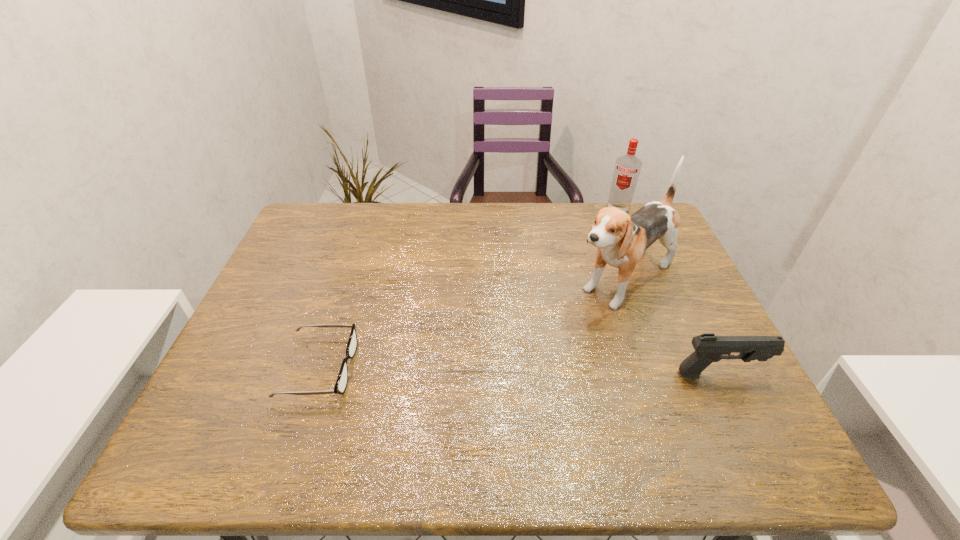
Locate an element on the screen. The image size is (960, 540). free space located on the front label of the second tallest object is located at coordinates (594, 271).

This screenshot has height=540, width=960. In order to click on vacant space located at the face of the puppy in this screenshot , I will do `click(546, 337)`.

Identify the location of free space located at the face of the puppy. point(564,322).

The width and height of the screenshot is (960, 540). In order to click on free space located 0.230m at the face of the puppy in this screenshot , I will do `click(526, 352)`.

This screenshot has width=960, height=540. In order to click on object situated at the far edge in this screenshot , I will do `click(627, 168)`.

I want to click on object located in the near edge section of the desktop, so click(x=342, y=380).

Image resolution: width=960 pixels, height=540 pixels. Find the location of `object at the left edge`. object at the left edge is located at coordinates (342, 380).

Identify the location of pistol located in the right edge section of the desktop. (709, 348).

Where is `vodka that is at the right edge`? This screenshot has height=540, width=960. vodka that is at the right edge is located at coordinates (627, 168).

In order to click on puppy that is at the right edge in this screenshot , I will do `click(621, 239)`.